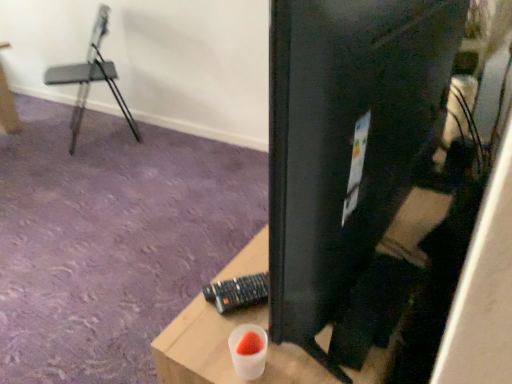
Where is `free spot below metallic gray armchair at left (from a real-world perspective)`? free spot below metallic gray armchair at left (from a real-world perspective) is located at coordinates pos(97,134).